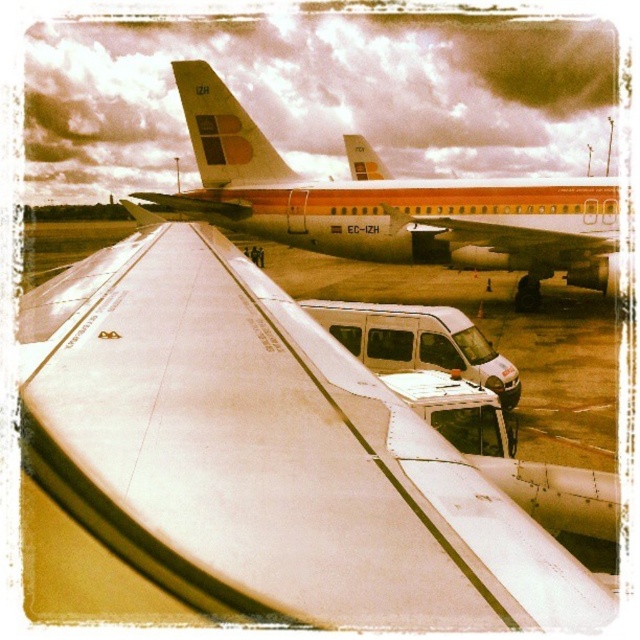
Question: Which of the following is the closest to the observer?

Choices:
 (A) (218, 122)
 (B) (492, 236)

Answer: (B)

Question: Can you confirm if white matte wing at center is positioned to the left of white matte van at center?

Choices:
 (A) yes
 (B) no

Answer: (A)

Question: Is white matte wing at center thinner than white matte van at center?

Choices:
 (A) yes
 (B) no

Answer: (A)

Question: Which point appears closest to the camera in this image?

Choices:
 (A) (515, 250)
 (B) (236, 163)

Answer: (A)

Question: Which of these objects is positioned farthest from the orange matte airliner at upper center?

Choices:
 (A) matte orange airplane wing at center
 (B) white matte wing at center

Answer: (B)

Question: Can you confirm if white matte wing at center is wider than matte orange airplane wing at center?

Choices:
 (A) no
 (B) yes

Answer: (A)